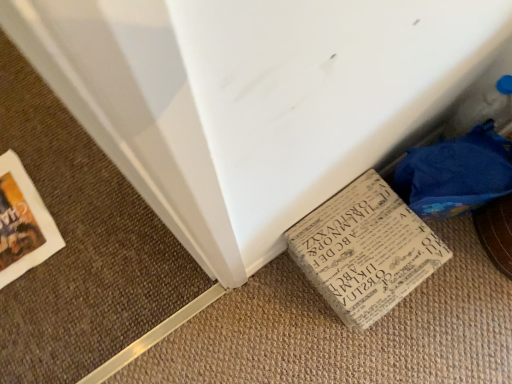
Question: Relative to printed paper book at lower right, is white paper puzzle at lower right in front or behind?

Choices:
 (A) front
 (B) behind

Answer: (A)

Question: From the image's perspective, is white paper puzzle at lower right located above or below printed paper book at lower right?

Choices:
 (A) above
 (B) below

Answer: (A)

Question: Based on their positions, is white paper puzzle at lower right located to the left or right of printed paper book at lower right?

Choices:
 (A) left
 (B) right

Answer: (B)

Question: Is printed paper book at lower right inside the boundaries of white paper puzzle at lower right, or outside?

Choices:
 (A) inside
 (B) outside

Answer: (B)

Question: From a real-world perspective, is printed paper book at lower right physically located above or below white paper puzzle at lower right?

Choices:
 (A) above
 (B) below

Answer: (B)

Question: Is printed paper book at lower right wider or thinner than white paper puzzle at lower right?

Choices:
 (A) wide
 (B) thin

Answer: (A)

Question: From the image's perspective, is printed paper book at lower right positioned above or below white paper puzzle at lower right?

Choices:
 (A) below
 (B) above

Answer: (A)